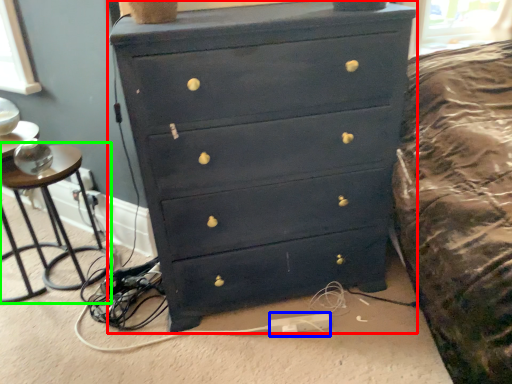
Question: Which object is the farthest from chest of drawers (highlighted by a red box)? Choose among these: extension cord (highlighted by a blue box) or side table (highlighted by a green box).

Choices:
 (A) extension cord
 (B) side table

Answer: (B)